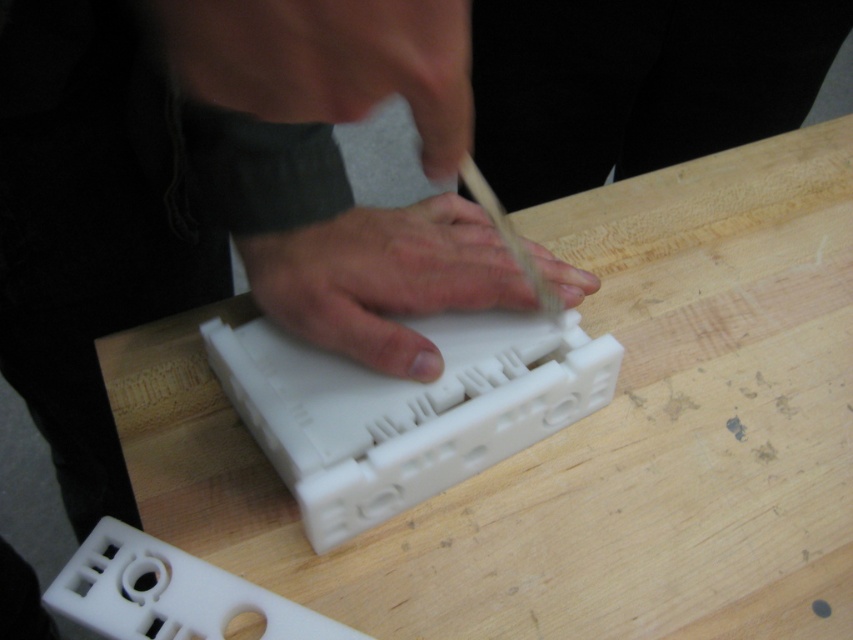
You are an observer looking at the scene. There are two hands present, the matte black hand at upper center and the white matte hand at center. Which hand is located above the other?

The matte black hand at upper center is positioned over the white matte hand at center.

You are a robotic arm trying to mimic the human hands in the image. The matte black hand at upper center and the white matte hand at center are performing a task. Which hand should you replicate first if you need to prioritize the one with the larger size?

The white matte hand at center should be replicated first because it is thicker than the matte black hand at upper center, indicating it has a larger size.

You are a 3D printing technician examining the white plastic object. You notice two points on the object labeled as point 1 at coordinates (202, 70) and point 2 at coordinates (404, 365). Which point is closer to your viewpoint?

Point 1 at coordinates (202, 70) is closer to your viewpoint than point 2 at coordinates (404, 365).